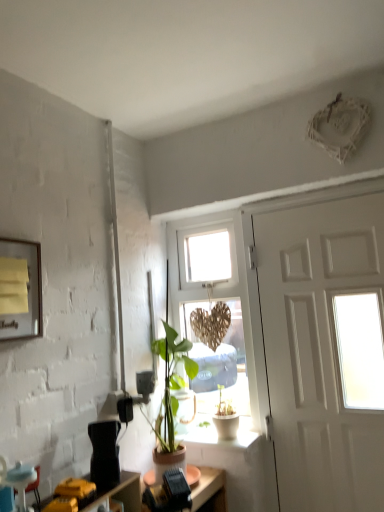
Question: Considering the relative positions of wooden heart at center and black plastic desk at lower center in the image provided, is wooden heart at center to the right of black plastic desk at lower center from the viewer's perspective?

Choices:
 (A) no
 (B) yes

Answer: (B)

Question: From the image's perspective, is wooden heart at center over black plastic desk at lower center?

Choices:
 (A) yes
 (B) no

Answer: (A)

Question: Is wooden heart at center positioned with its back to black plastic desk at lower center?

Choices:
 (A) no
 (B) yes

Answer: (A)

Question: From the image's perspective, would you say wooden heart at center is shown under black plastic desk at lower center?

Choices:
 (A) yes
 (B) no

Answer: (B)

Question: Is wooden heart at center wider than black plastic desk at lower center?

Choices:
 (A) yes
 (B) no

Answer: (B)

Question: From a real-world perspective, is wooden heart at center under black plastic desk at lower center?

Choices:
 (A) yes
 (B) no

Answer: (B)

Question: Is black plastic desk at lower center surrounding blue fabric armchair at lower left?

Choices:
 (A) no
 (B) yes

Answer: (A)

Question: Is black plastic desk at lower center oriented away from blue fabric armchair at lower left?

Choices:
 (A) no
 (B) yes

Answer: (A)

Question: From the image's perspective, is black plastic desk at lower center over blue fabric armchair at lower left?

Choices:
 (A) yes
 (B) no

Answer: (B)

Question: From a real-world perspective, does black plastic desk at lower center stand above blue fabric armchair at lower left?

Choices:
 (A) no
 (B) yes

Answer: (A)

Question: Considering the relative sizes of black plastic desk at lower center and blue fabric armchair at lower left in the image provided, is black plastic desk at lower center wider than blue fabric armchair at lower left?

Choices:
 (A) yes
 (B) no

Answer: (A)

Question: Can you see black plastic desk at lower center touching blue fabric armchair at lower left?

Choices:
 (A) yes
 (B) no

Answer: (B)

Question: Is blue fabric armchair at lower left surrounded by yellow paper at upper left?

Choices:
 (A) yes
 (B) no

Answer: (B)